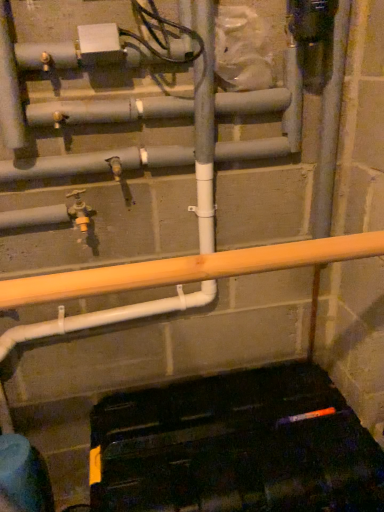
Question: From a real-world perspective, is matte gray pipe at upper center, arranged as the 1th pipe when viewed from the top, on gray matte pipe at center, acting as the 1th pipe starting from the bottom?

Choices:
 (A) no
 (B) yes

Answer: (B)

Question: Is matte gray pipe at upper center, the 2th pipe when ordered from bottom to top, in front of gray matte pipe at center, acting as the 1th pipe starting from the bottom?

Choices:
 (A) no
 (B) yes

Answer: (B)

Question: From the image's perspective, is matte gray pipe at upper center, the 2th pipe when ordered from bottom to top, beneath gray matte pipe at center, acting as the second pipe starting from the top?

Choices:
 (A) yes
 (B) no

Answer: (B)

Question: Is gray matte pipe at center, acting as the 1th pipe starting from the bottom, completely or partially inside matte gray pipe at upper center, the 2th pipe when ordered from bottom to top?

Choices:
 (A) yes
 (B) no

Answer: (B)

Question: Is matte gray pipe at upper center, arranged as the 1th pipe when viewed from the top, wider than gray matte pipe at center, acting as the 1th pipe starting from the bottom?

Choices:
 (A) yes
 (B) no

Answer: (B)

Question: Is gray matte pipe at center in front of or behind orange wood beam at center in the image?

Choices:
 (A) behind
 (B) front

Answer: (A)

Question: From their relative heights in the image, would you say gray matte pipe at center is taller or shorter than orange wood beam at center?

Choices:
 (A) short
 (B) tall

Answer: (B)

Question: From a real-world perspective, relative to orange wood beam at center, is gray matte pipe at center vertically above or below?

Choices:
 (A) below
 (B) above

Answer: (B)

Question: From the image's perspective, relative to orange wood beam at center, is gray matte pipe at center above or below?

Choices:
 (A) above
 (B) below

Answer: (A)

Question: Considering the positions of orange wood beam at center and matte gray pipe at upper center, the 2th pipe when ordered from bottom to top, in the image, is orange wood beam at center bigger or smaller than matte gray pipe at upper center, the 2th pipe when ordered from bottom to top,?

Choices:
 (A) small
 (B) big

Answer: (B)

Question: Considering the positions of point (56, 285) and point (51, 116), is point (56, 285) closer or farther from the camera than point (51, 116)?

Choices:
 (A) closer
 (B) farther

Answer: (A)

Question: In terms of height, does orange wood beam at center look taller or shorter compared to matte gray pipe at upper center, arranged as the 1th pipe when viewed from the top?

Choices:
 (A) tall
 (B) short

Answer: (B)

Question: From the image's perspective, is orange wood beam at center above or below matte gray pipe at upper center, arranged as the 1th pipe when viewed from the top?

Choices:
 (A) below
 (B) above

Answer: (A)

Question: Choose the correct answer: Is orange wood beam at center inside gray matte pipe at center, acting as the second pipe starting from the top, or outside it?

Choices:
 (A) outside
 (B) inside

Answer: (A)

Question: In terms of height, does orange wood beam at center look taller or shorter compared to gray matte pipe at center, acting as the 1th pipe starting from the bottom?

Choices:
 (A) short
 (B) tall

Answer: (A)